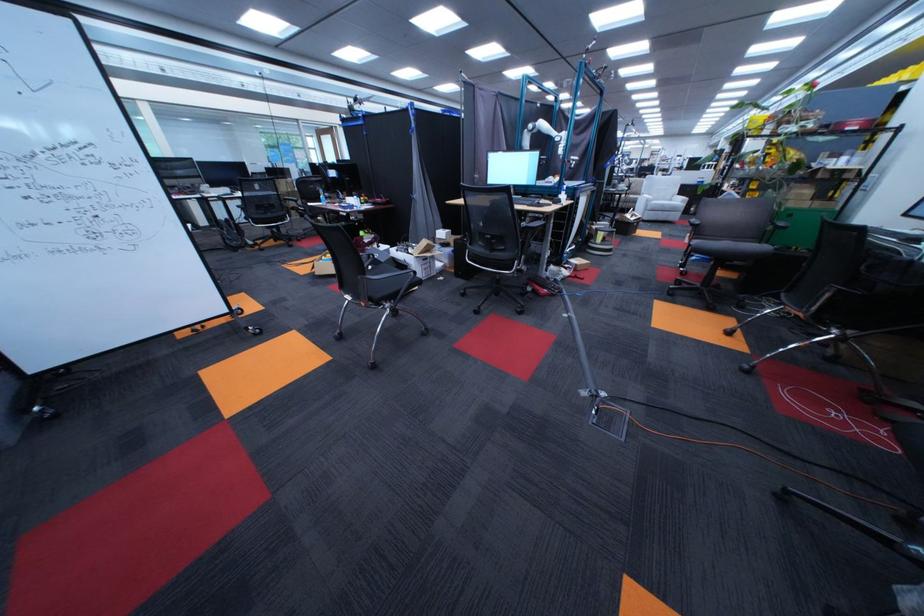
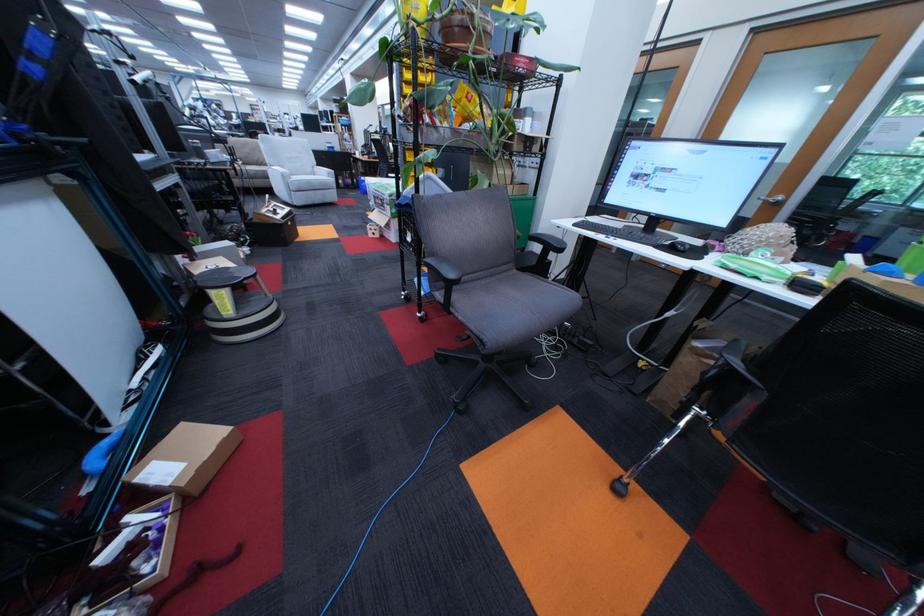
Locate, in the second image, the point that corresponds to the point at 661,201 in the first image.

(298, 177)